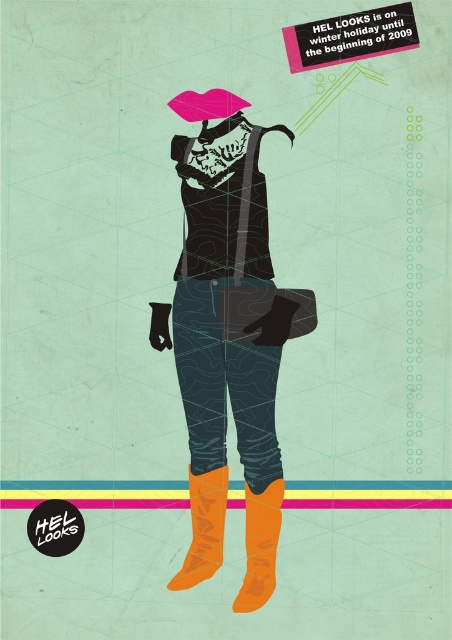
Question: Which object is closer to the camera taking this photo?

Choices:
 (A) pink matte umbrella at upper center
 (B) orange suede boot at lower right
 (C) orange matte boot at lower center

Answer: (A)

Question: Does matte black vest at center appear on the right side of orange suede boot at lower right?

Choices:
 (A) no
 (B) yes

Answer: (A)

Question: Which point appears farthest from the camera in this image?

Choices:
 (A) (193, 116)
 (B) (263, 394)

Answer: (A)

Question: Is matte black vest at center positioned behind pink matte umbrella at upper center?

Choices:
 (A) yes
 (B) no

Answer: (B)

Question: Considering the relative positions of orange matte boot at lower center and pink matte umbrella at upper center in the image provided, where is orange matte boot at lower center located with respect to pink matte umbrella at upper center?

Choices:
 (A) below
 (B) above

Answer: (A)

Question: Which of the following is the farthest from the observer?

Choices:
 (A) (245, 552)
 (B) (193, 483)
 (C) (201, 358)
 (D) (213, 102)

Answer: (B)